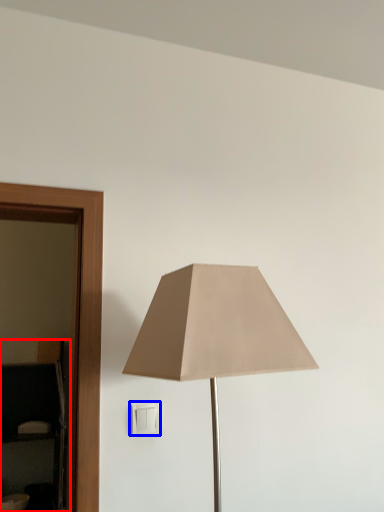
Question: Which object appears closest to the camera in this image, dresser (highlighted by a red box) or light switch (highlighted by a blue box)?

Choices:
 (A) dresser
 (B) light switch

Answer: (B)